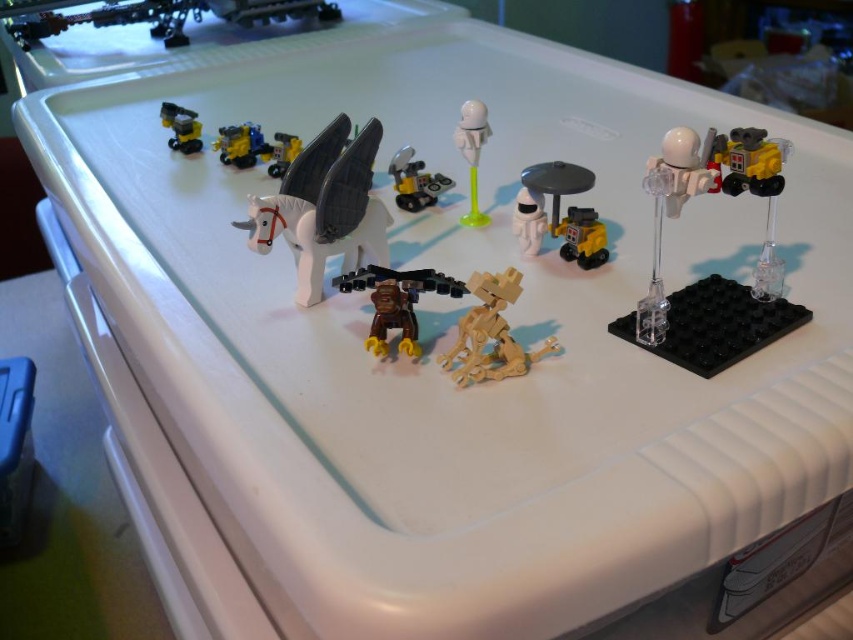
You are organizing a display of LEGO figures on a shelf. The clear plastic robot at upper right and the white matte astronaut at center need to be placed side by side. Based on their widths, which one should be placed first to ensure they fit properly?

The clear plastic robot at upper right is wider than the white matte astronaut at center. To ensure they fit side by side, place the wider clear plastic robot at upper right first, followed by the narrower white matte astronaut at center.

You are organizing a display of miniature models and need to place the wooden figure at center and the yellow plastic robot at upper right on a shelf. The shelf has a height limit of 15 cm. Can both items fit vertically without exceeding the height limit?

The wooden figure at center is larger than the yellow plastic robot at upper right. Since the shelf has a height limit of 15 cm, we need to ensure the tallest item does not exceed this. If the wooden figure at center is taller than 15 cm, it would not fit. However, without specific height measurements, we can only confirm that the yellow plastic robot at upper right is shorter than the wooden figure at center. If the wooden figure at center is under 15 cm, both would fit. Please provide the exact heights to

You are trying to build a spaceship model. The clear plastic robot at upper right and the white matte astronaut at center are both part of your design. According to the arrangement in the image, which object is placed lower in the scene?

The clear plastic robot at upper right is positioned under the white matte astronaut at center, so it is placed lower in the scene.